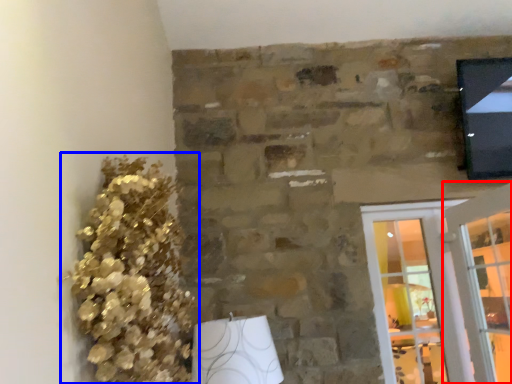
Question: Which object appears farthest to the camera in this image, glass door (highlighted by a red box) or floral arrangement (highlighted by a blue box)?

Choices:
 (A) glass door
 (B) floral arrangement

Answer: (A)